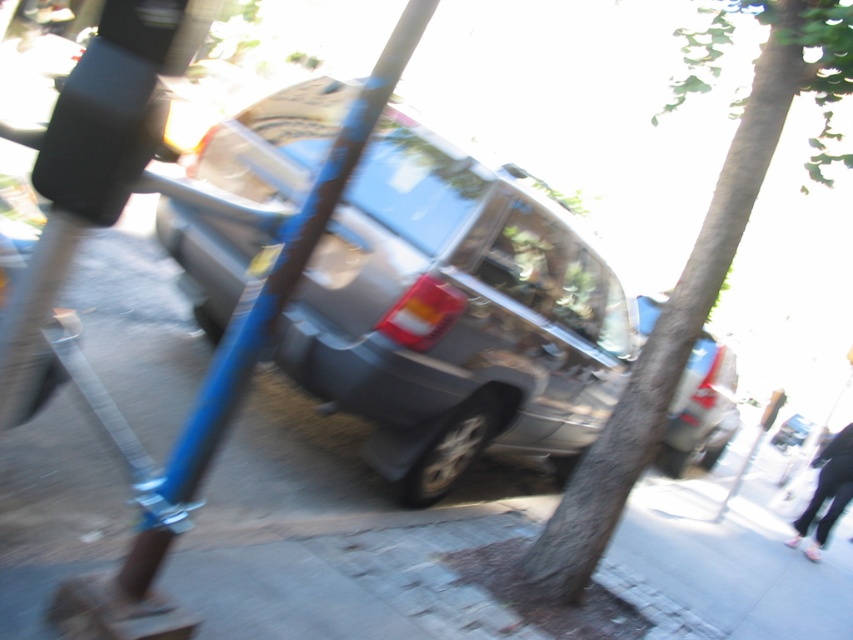
Question: Is the position of satin silver minivan at center more distant than that of blue metallic pole at center?

Choices:
 (A) no
 (B) yes

Answer: (B)

Question: Among these points, which one is nearest to the camera?

Choices:
 (A) (798, 422)
 (B) (369, 392)
 (C) (260, 301)

Answer: (C)

Question: Does satin silver minivan at center lie behind blue metallic pole at center?

Choices:
 (A) yes
 (B) no

Answer: (A)

Question: Can you confirm if blue metallic pole at center is bigger than silver metallic suv at center?

Choices:
 (A) yes
 (B) no

Answer: (A)

Question: Which of the following is the closest to the observer?

Choices:
 (A) satin silver minivan at center
 (B) silver metallic suv at center
 (C) green rough bark tree at center

Answer: (C)

Question: Which point appears closest to the camera in this image?

Choices:
 (A) (799, 438)
 (B) (149, 444)

Answer: (B)